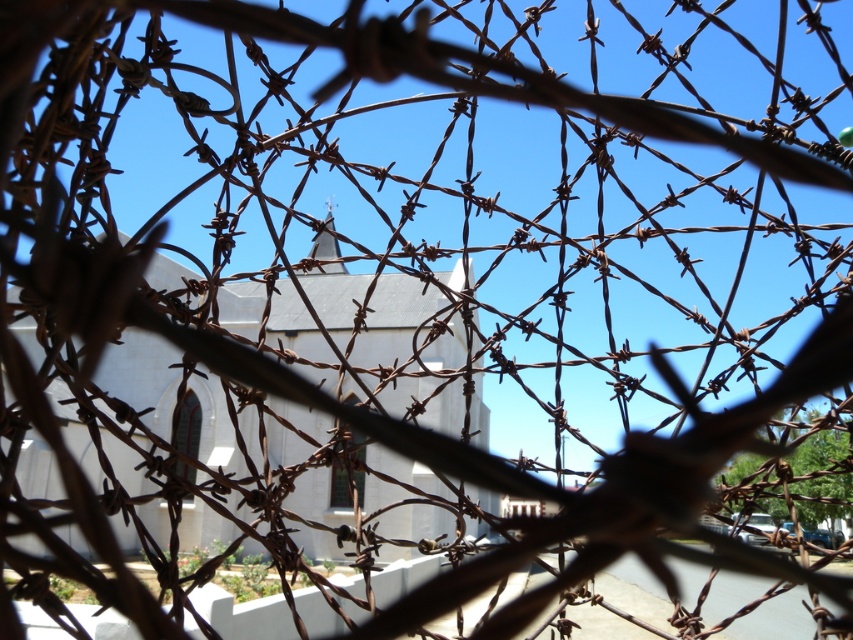
You are standing in front of a barbed wire fence and looking at the white matte chapel at center and the rusty metal spire at center. Which object is closer to you?

The white matte chapel at center is closer to the viewer than the rusty metal spire at center.

You are a photographer standing in front of the barbed wire fence. You want to capture a photo where the white matte chapel at center is positioned above the rusty metal spire at center. Is this possible with the current arrangement?

The white matte chapel at center is located below the rusty metal spire at center, so it is not possible to position the chapel above the spire in the current arrangement.